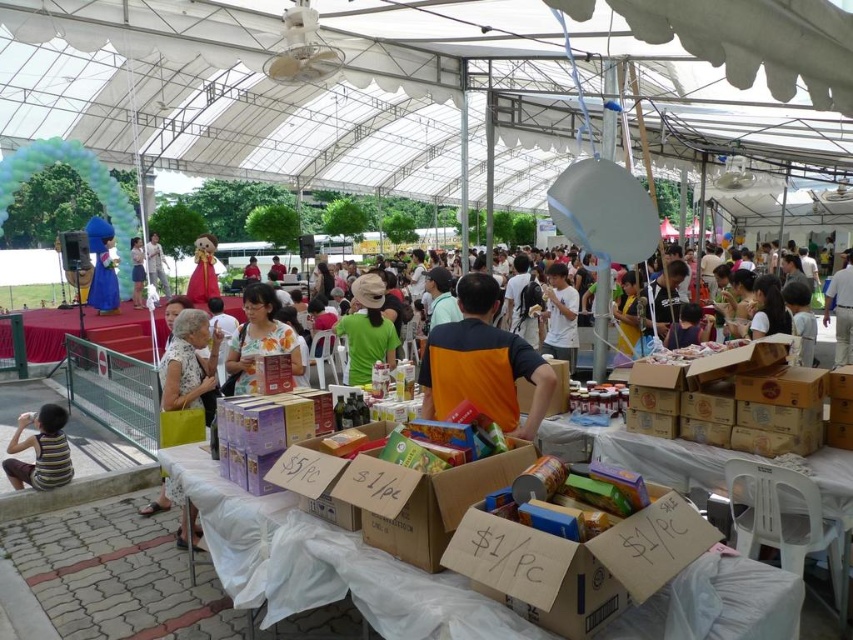
Question: Does orange fabric shirt at center have a lesser width compared to striped cotton shirt at lower left?

Choices:
 (A) yes
 (B) no

Answer: (B)

Question: Is cardboard boxes at center in front of matte gold statue at center?

Choices:
 (A) yes
 (B) no

Answer: (A)

Question: Among these points, which one is farthest from the camera?

Choices:
 (A) (389, 326)
 (B) (212, 260)
 (C) (577, 552)

Answer: (B)

Question: Which point appears farthest from the camera in this image?

Choices:
 (A) (363, 330)
 (B) (328, 579)

Answer: (A)

Question: Which of the following is the closest to the observer?

Choices:
 (A) green matte shirt at center
 (B) white dotted dress at left
 (C) cardboard boxes at center
 (D) white matte shirt at center

Answer: (C)

Question: From the image, what is the correct spatial relationship of white dotted dress at left in relation to green matte shirt at center?

Choices:
 (A) right
 (B) left

Answer: (B)